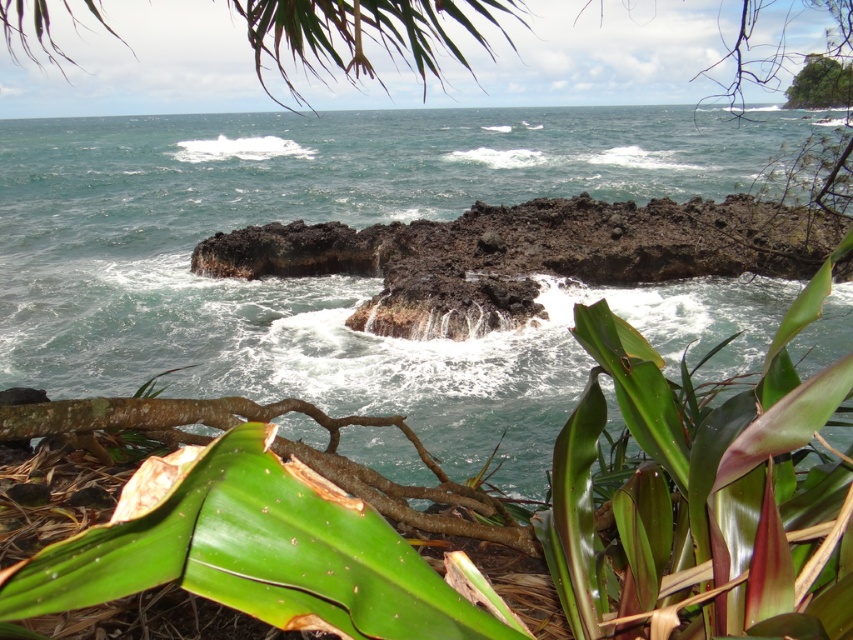
Question: Does greenish-blue water at center appear on the right side of green leafy bush at upper right?

Choices:
 (A) no
 (B) yes

Answer: (A)

Question: Which point is farther to the camera?

Choices:
 (A) green leafy bush at upper right
 (B) greenish-blue water at center
 (C) volcanic rock at center

Answer: (A)

Question: Which object is farther from the camera taking this photo?

Choices:
 (A) green leafy bush at upper right
 (B) volcanic rock at center
 (C) greenish-blue water at center

Answer: (A)

Question: Is greenish-blue water at center further to the viewer compared to green leafy bush at upper right?

Choices:
 (A) no
 (B) yes

Answer: (A)

Question: Among these objects, which one is farthest from the camera?

Choices:
 (A) green leafy bush at upper right
 (B) volcanic rock at center
 (C) greenish-blue water at center

Answer: (A)

Question: Can you confirm if volcanic rock at center is wider than green leafy bush at upper right?

Choices:
 (A) no
 (B) yes

Answer: (A)